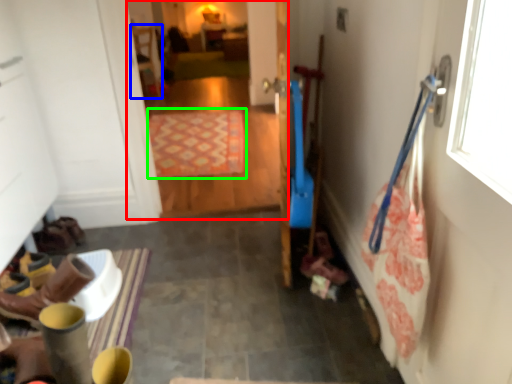
Question: Which object is the closest to the corridor (highlighted by a red box)? Choose among these: chair (highlighted by a blue box) or mat (highlighted by a green box).

Choices:
 (A) chair
 (B) mat

Answer: (B)